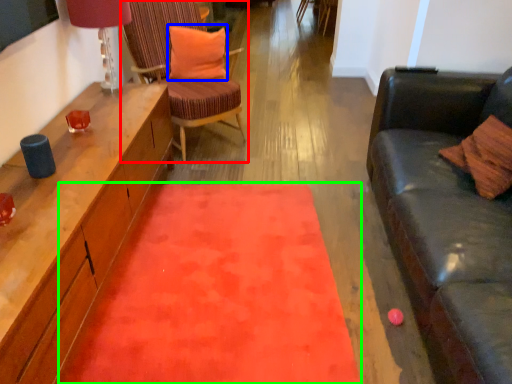
Question: Based on their relative distances, which object is nearer to chair (highlighted by a red box)? Choose from pillow (highlighted by a blue box) and mat (highlighted by a green box).

Choices:
 (A) pillow
 (B) mat

Answer: (A)